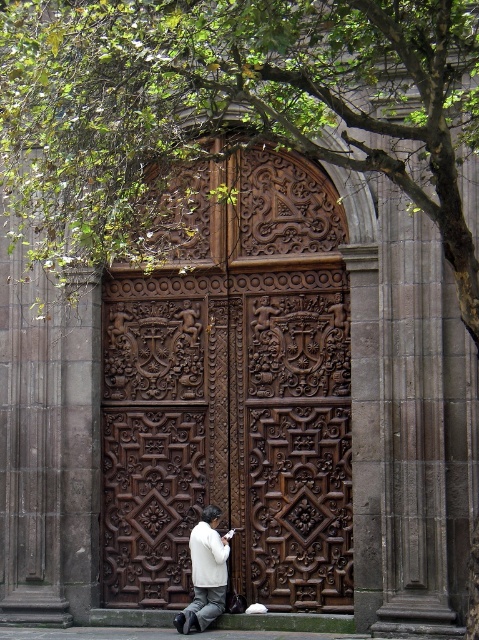
Question: Observing the image, what is the correct spatial positioning of dark brown wood at center in reference to white matte jacket at lower center?

Choices:
 (A) above
 (B) below

Answer: (A)

Question: Considering the relative positions of dark brown wood at center and white matte jacket at lower center in the image provided, where is dark brown wood at center located with respect to white matte jacket at lower center?

Choices:
 (A) above
 (B) below

Answer: (A)

Question: In this image, where is dark brown wood at center located relative to white matte jacket at lower center?

Choices:
 (A) above
 (B) below

Answer: (A)